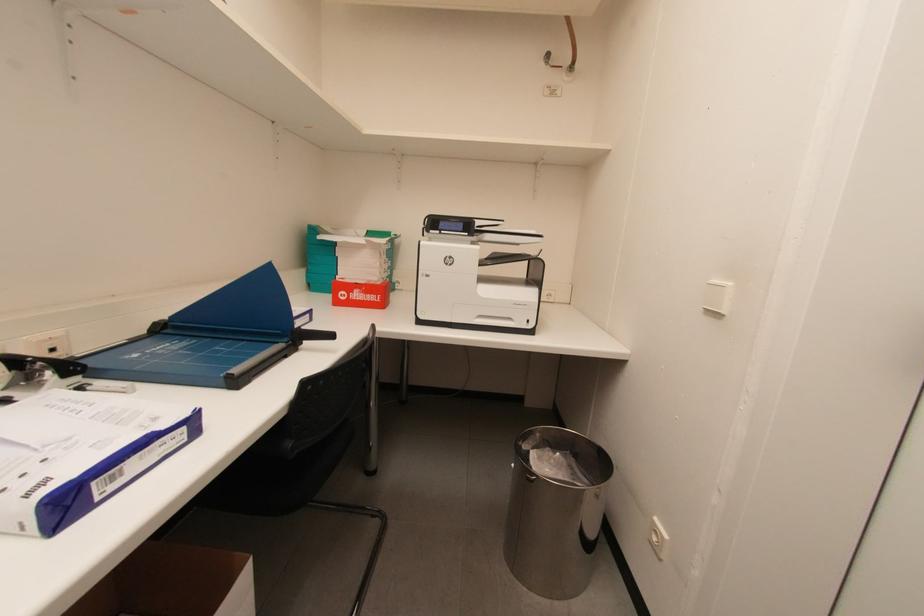
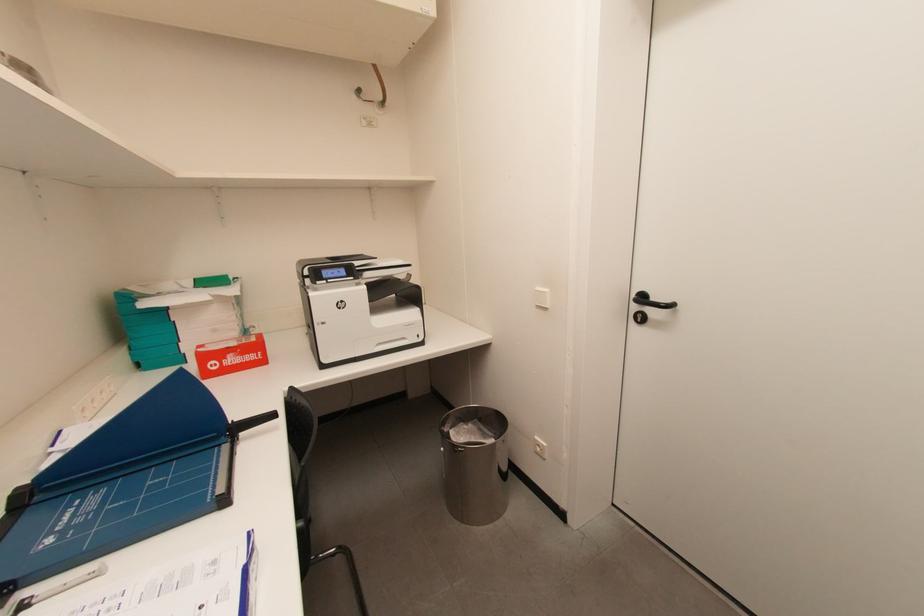
Question: The first image is from the beginning of the video and the second image is from the end. How did the camera likely rotate when shooting the video?

Choices:
 (A) Left
 (B) Right
 (C) Up
 (D) Down

Answer: (B)